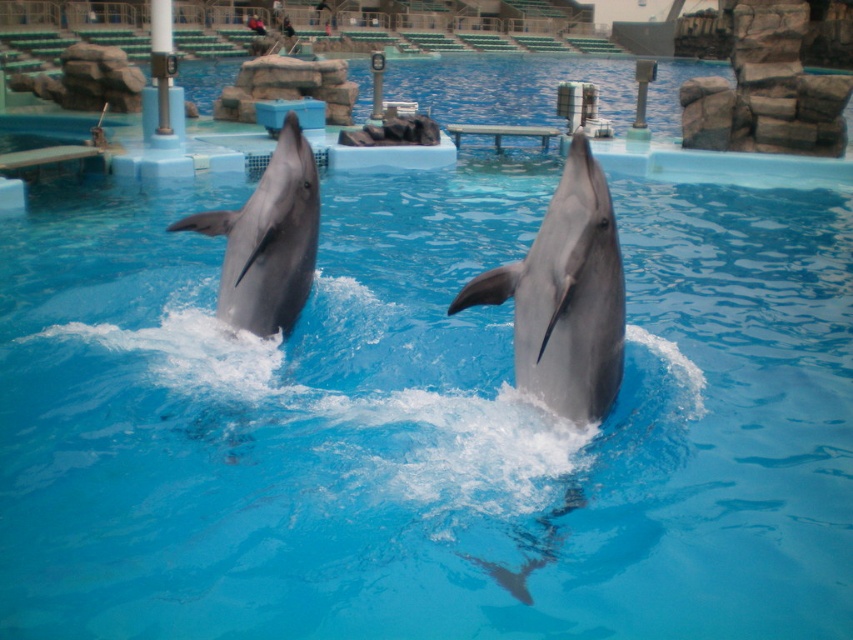
Does smooth gray dolphin at center appear over glossy gray dolphin at center?

No.

Does smooth gray dolphin at center have a greater height compared to glossy gray dolphin at center?

Indeed, smooth gray dolphin at center has a greater height compared to glossy gray dolphin at center.

Locate an element on the screen. smooth gray dolphin at center is located at coordinates (566, 296).

Identify the location of smooth gray dolphin at center. (566, 296).